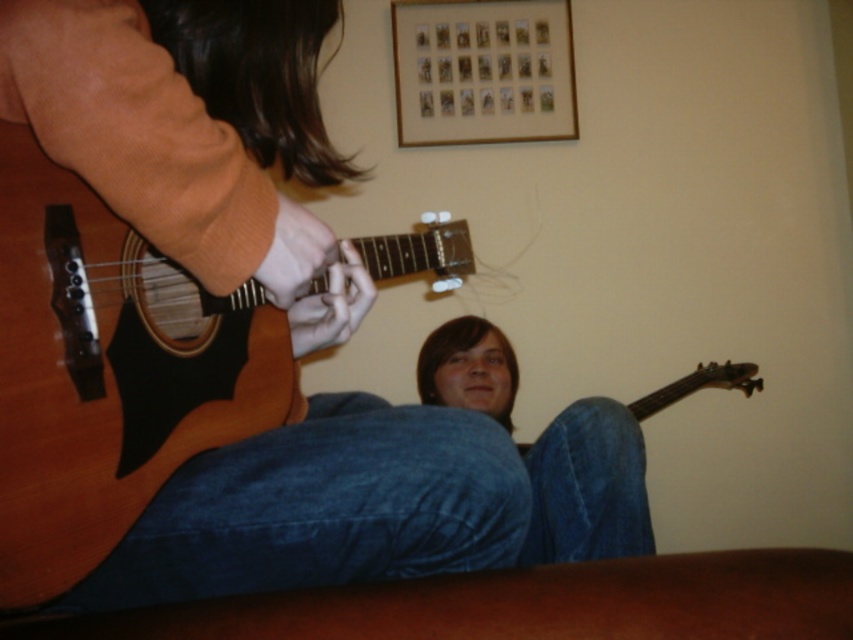
Question: Which of these objects is positioned closest to the wooden acoustic guitar at left?

Choices:
 (A) wooden frame at upper center
 (B) blue denim jeans at lower center

Answer: (B)

Question: Is wooden acoustic guitar at left thinner than wooden frame at upper center?

Choices:
 (A) yes
 (B) no

Answer: (A)

Question: Can you confirm if blue denim jeans at lower center is positioned to the right of wooden frame at upper center?

Choices:
 (A) yes
 (B) no

Answer: (A)

Question: Which of the following is the farthest from the observer?

Choices:
 (A) (424, 362)
 (B) (531, 128)

Answer: (B)

Question: Is the position of wooden acoustic guitar at left more distant than that of blue denim jeans at lower center?

Choices:
 (A) yes
 (B) no

Answer: (B)

Question: Which object is closer to the camera taking this photo?

Choices:
 (A) blue denim jeans at lower center
 (B) wooden acoustic guitar at left
 (C) wooden frame at upper center

Answer: (B)